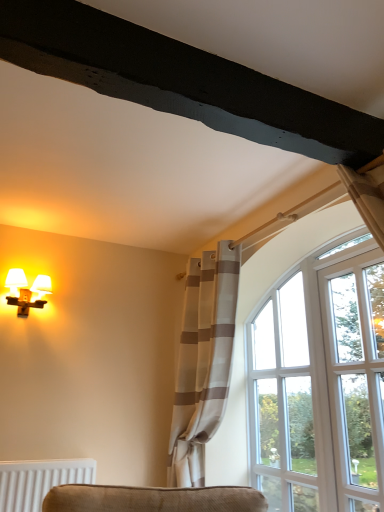
Question: Is clear glass door at right with matte white sconce at left?

Choices:
 (A) yes
 (B) no

Answer: (B)

Question: Can you confirm if clear glass door at right is bigger than matte white sconce at left?

Choices:
 (A) no
 (B) yes

Answer: (B)

Question: Is clear glass door at right turned away from matte white sconce at left?

Choices:
 (A) no
 (B) yes

Answer: (A)

Question: Is clear glass door at right at the right side of matte white sconce at left?

Choices:
 (A) yes
 (B) no

Answer: (A)

Question: From the image's perspective, would you say clear glass door at right is positioned over matte white sconce at left?

Choices:
 (A) yes
 (B) no

Answer: (B)

Question: Considering the relative sizes of clear glass door at right and matte white sconce at left in the image provided, is clear glass door at right shorter than matte white sconce at left?

Choices:
 (A) no
 (B) yes

Answer: (A)

Question: Does clear glass window at upper right come in front of white striped curtain at right?

Choices:
 (A) yes
 (B) no

Answer: (B)

Question: Is white striped curtain at right at the back of clear glass window at upper right?

Choices:
 (A) no
 (B) yes

Answer: (B)

Question: From the image's perspective, would you say clear glass window at upper right is positioned over white striped curtain at right?

Choices:
 (A) yes
 (B) no

Answer: (B)

Question: Is clear glass window at upper right to the left of white striped curtain at right from the viewer's perspective?

Choices:
 (A) yes
 (B) no

Answer: (B)

Question: Is clear glass window at upper right outside of white striped curtain at right?

Choices:
 (A) no
 (B) yes

Answer: (B)

Question: Can you confirm if clear glass window at upper right is taller than white striped curtain at right?

Choices:
 (A) no
 (B) yes

Answer: (A)

Question: From a real-world perspective, is clear glass window at upper right on top of matte white sconce at left?

Choices:
 (A) no
 (B) yes

Answer: (A)